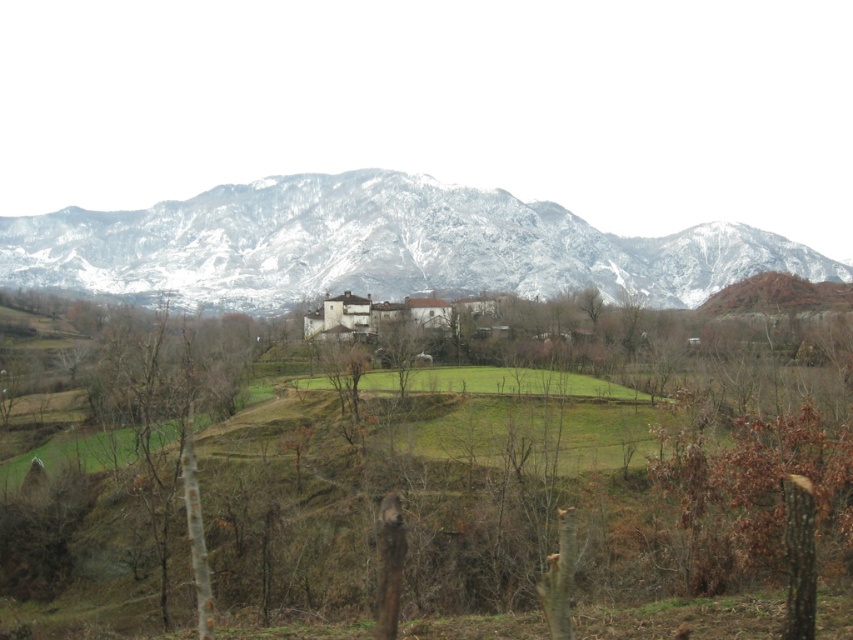
Question: Is brown rough tree at center below snowy rock mountain range at upper center?

Choices:
 (A) yes
 (B) no

Answer: (A)

Question: Which point is closer to the camera?

Choices:
 (A) brown rough tree at center
 (B) snowy rock mountain range at upper center

Answer: (A)

Question: Does brown rough tree at center lie in front of snowy rock mountain range at upper center?

Choices:
 (A) no
 (B) yes

Answer: (B)

Question: Is brown rough tree at center closer to the viewer compared to snowy rock mountain range at upper center?

Choices:
 (A) yes
 (B) no

Answer: (A)